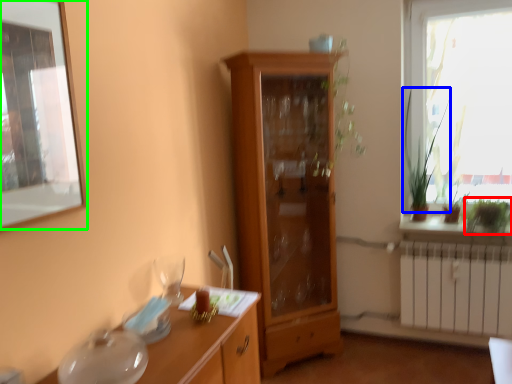
Question: Based on their relative distances, which object is nearer to plant (highlighted by a red box)? Choose from plant (highlighted by a blue box) and window screen (highlighted by a green box).

Choices:
 (A) plant
 (B) window screen

Answer: (A)